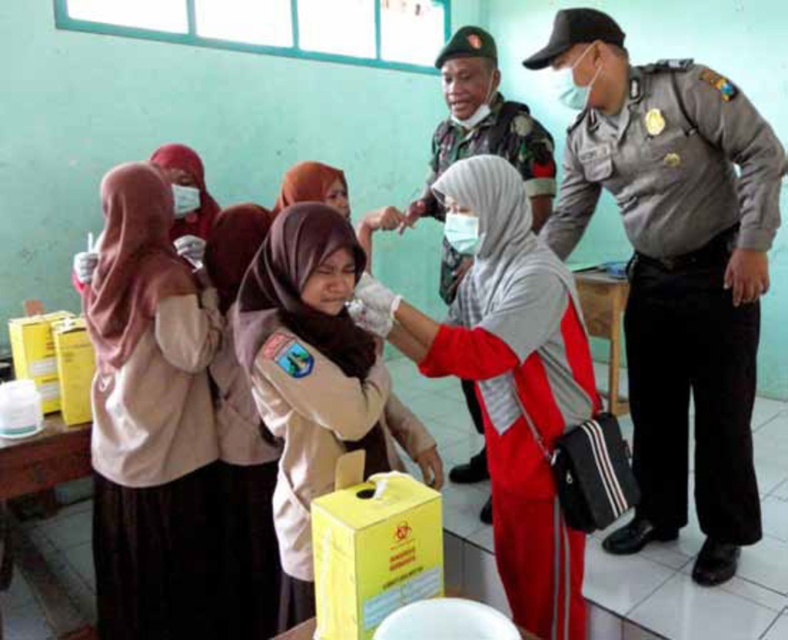
You are a visitor at this vaccination center. You need to find the nurse who is currently administering the vaccine. Which one is closer to the front of the room between the gray uniformed officer at right and the matte white uniform at center?

The gray uniformed officer at right is closer to the front of the room because the matte white uniform at center is behind them.

You are a patient in a vaccination center and you see the red fabric hijab at center and the matte white uniform at center. Which one is closer to you?

The red fabric hijab at center is closer to you because it is further to the viewer than the matte white uniform at center.